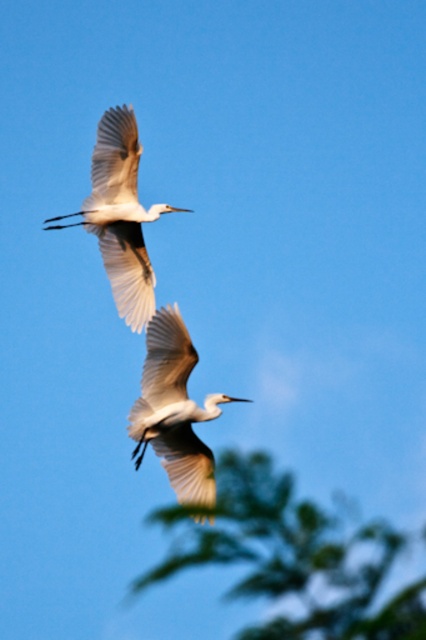
Is green leafy tree at lower center to the right of white matte bird at upper left from the viewer's perspective?

Yes, green leafy tree at lower center is to the right of white matte bird at upper left.

Can you confirm if green leafy tree at lower center is positioned to the left of white matte bird at upper left?

Incorrect, green leafy tree at lower center is not on the left side of white matte bird at upper left.

Is point (222, 465) farther from viewer compared to point (140, 262)?

Yes, point (222, 465) is behind point (140, 262).

Locate an element on the screen. The width and height of the screenshot is (426, 640). green leafy tree at lower center is located at coordinates (291, 556).

Is green leafy tree at lower center to the left of white matte bird at center from the viewer's perspective?

No, green leafy tree at lower center is not to the left of white matte bird at center.

Is green leafy tree at lower center behind white matte bird at center?

No, green leafy tree at lower center is closer to the viewer.

Is point (400, 612) positioned in front of point (172, 460)?

Yes, point (400, 612) is in front of point (172, 460).

Image resolution: width=426 pixels, height=640 pixels. In order to click on green leafy tree at lower center in this screenshot , I will do `click(291, 556)`.

Is white matte bird at center positioned at the back of white matte bird at upper left?

No, it is in front of white matte bird at upper left.

I want to click on white matte bird at center, so click(x=173, y=410).

Identify the location of white matte bird at center. (173, 410).